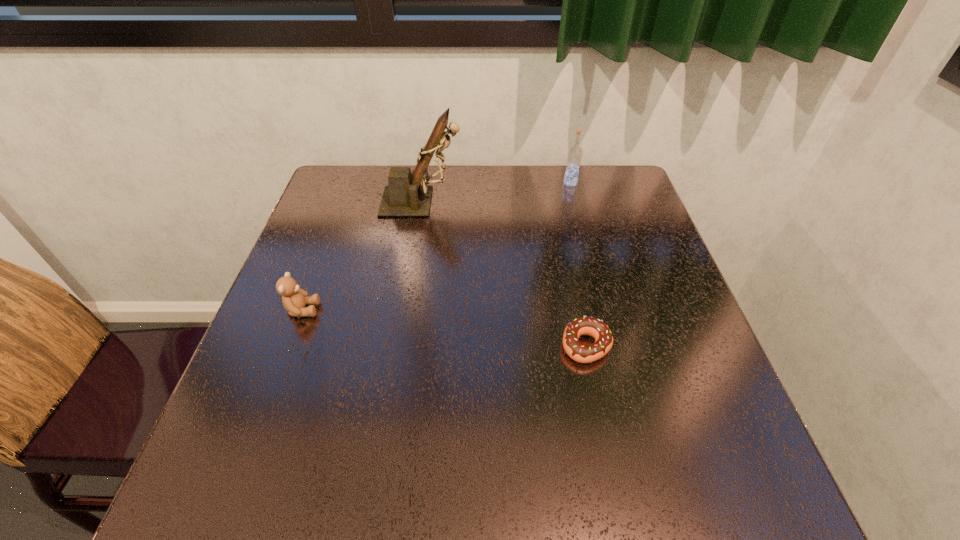
At what (x,y) coordinates should I click in order to perform the action: click on free space between the shortest object and the teddy bear. Please return your answer as a coordinate pair (x, y). This screenshot has width=960, height=540. Looking at the image, I should click on (444, 328).

Identify the location of empty space between the second farthest object and the second tallest object. The image size is (960, 540). (496, 192).

Where is `free spot between the third object from right to left and the nearest object`? Image resolution: width=960 pixels, height=540 pixels. free spot between the third object from right to left and the nearest object is located at coordinates (504, 274).

Image resolution: width=960 pixels, height=540 pixels. What are the coordinates of `unoccupied position between the shortest object and the figurine` in the screenshot? It's located at (504, 274).

Find the location of a particular element. unoccupied area between the farthest object and the figurine is located at coordinates (496, 192).

Locate which object ranks in proximity to the figurine. Please provide its 2D coordinates. Your answer should be formatted as a tuple, i.e. [(x, y)], where the tuple contains the x and y coordinates of a point satisfying the conditions above.

[(574, 156)]

Image resolution: width=960 pixels, height=540 pixels. I want to click on object that is the closest to the teddy bear, so pos(404,196).

The image size is (960, 540). I want to click on free space that satisfies the following two spatial constraints: 1. on the front-facing side of the nearest object; 2. on the right side of the second object from left to right, so click(399, 346).

Locate an element on the screen. This screenshot has height=540, width=960. free location that satisfies the following two spatial constraints: 1. on the front-facing side of the tallest object; 2. on the right side of the doughnut is located at coordinates (399, 346).

Where is `blank space that satisfies the following two spatial constraints: 1. on the back side of the second tallest object; 2. on the left side of the doughnut`? Image resolution: width=960 pixels, height=540 pixels. blank space that satisfies the following two spatial constraints: 1. on the back side of the second tallest object; 2. on the left side of the doughnut is located at coordinates (552, 183).